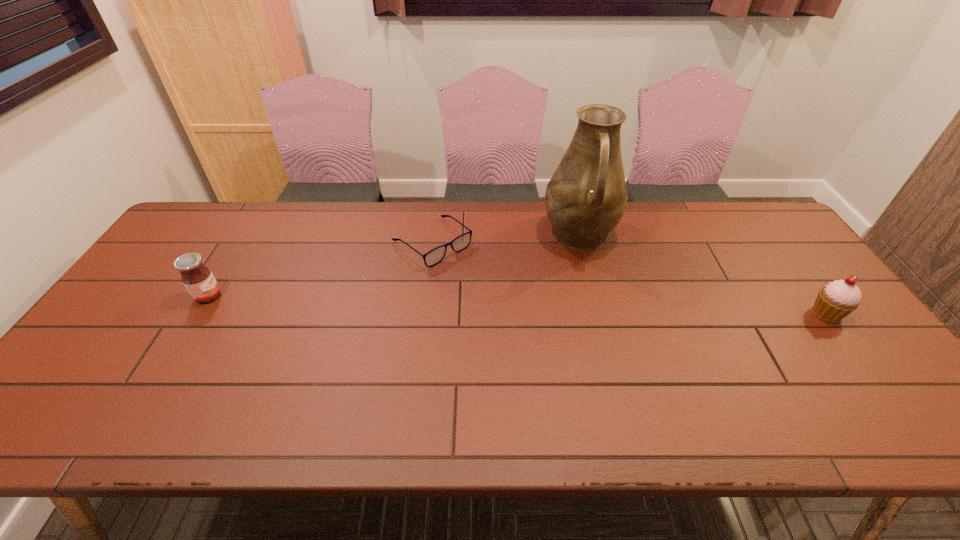
The height and width of the screenshot is (540, 960). What are the coordinates of `vacant area at the far left corner` in the screenshot? It's located at 212,204.

Locate an element on the screen. free space at the near left corner of the desktop is located at coordinates coord(92,381).

This screenshot has height=540, width=960. I want to click on free space at the near right corner of the desktop, so click(834, 389).

Find the location of a particular element. The image size is (960, 540). free point between the cupcake and the jam is located at coordinates (517, 305).

At what (x,y) coordinates should I click in order to perform the action: click on free space between the shortest object and the cupcake. Please return your answer as a coordinate pair (x, y). Image resolution: width=960 pixels, height=540 pixels. Looking at the image, I should click on (630, 278).

In order to click on vacant area that lies between the leftmost object and the cupcake in this screenshot , I will do `click(517, 305)`.

I want to click on free spot between the third object from left to right and the leftmost object, so coord(395,266).

You are a GUI agent. You are given a task and a screenshot of the screen. Output one action in this format:
    pyautogui.click(x=<x>, y=<y>)
    Task: Click on the vacant space in between the shortest object and the jam
    
    Given the screenshot: What is the action you would take?
    pyautogui.click(x=321, y=269)

The width and height of the screenshot is (960, 540). In order to click on free space that is in between the rightmost object and the third object from right to left in this screenshot , I will do `click(630, 278)`.

What are the coordinates of `unoccupied position between the cupcake and the spectacles` in the screenshot? It's located at (630, 278).